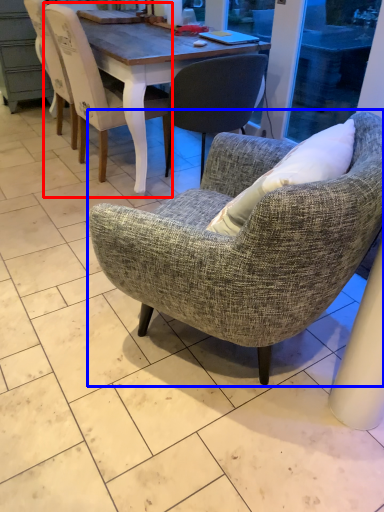
Question: Among these objects, which one is farthest to the camera, chair (highlighted by a red box) or chair (highlighted by a blue box)?

Choices:
 (A) chair
 (B) chair

Answer: (A)